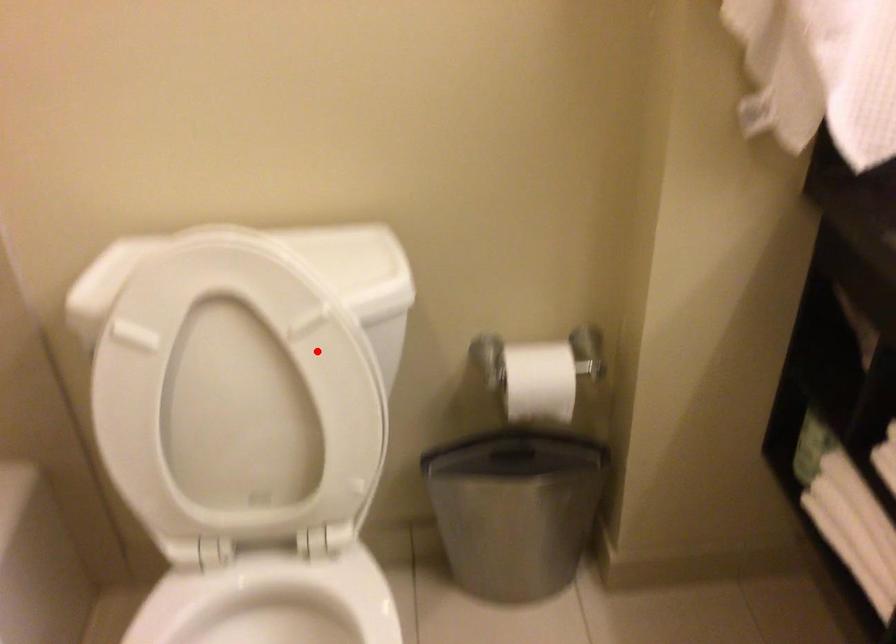
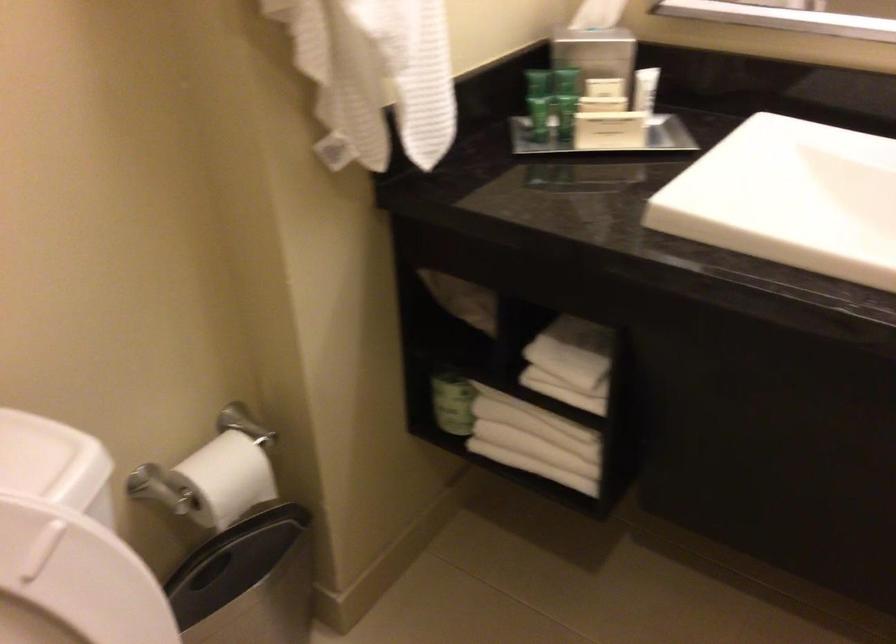
Question: I am providing you with two images of the same scene from different viewpoints. A red point is marked on the first image. Can you still see the location of the red point in image 2?

Choices:
 (A) Yes
 (B) No

Answer: (A)